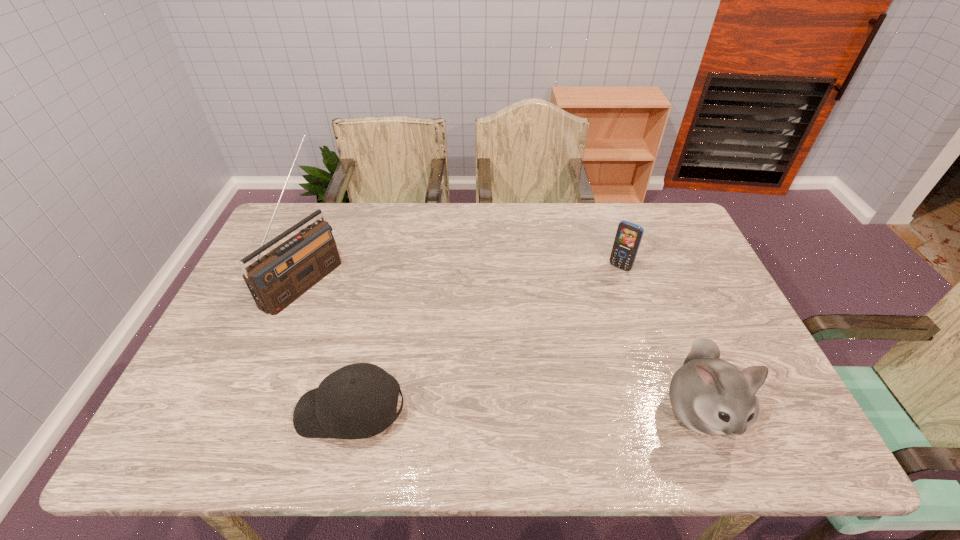
Find the location of a particular element. Image resolution: width=960 pixels, height=540 pixels. vacant region at the far edge of the desktop is located at coordinates (509, 217).

At what (x,y) coordinates should I click in order to perform the action: click on free space at the near edge of the desktop. Please return your answer as a coordinate pair (x, y). The height and width of the screenshot is (540, 960). Looking at the image, I should click on (653, 378).

In the image, there is a desktop. At what (x,y) coordinates should I click in order to perform the action: click on vacant space at the left edge. Please return your answer as a coordinate pair (x, y). The width and height of the screenshot is (960, 540). Looking at the image, I should click on click(248, 308).

The width and height of the screenshot is (960, 540). I want to click on vacant region at the right edge of the desktop, so click(678, 288).

Where is `vacant space at the far left corner`? The width and height of the screenshot is (960, 540). vacant space at the far left corner is located at coordinates (284, 221).

Find the location of a particular element. The image size is (960, 540). free space at the far right corner of the desktop is located at coordinates (647, 212).

Image resolution: width=960 pixels, height=540 pixels. In the image, there is a desktop. Find the location of `vacant space at the near right corner`. vacant space at the near right corner is located at coordinates (771, 409).

Find the location of `unoccupied position between the baseball cap and the cellular telephone`. unoccupied position between the baseball cap and the cellular telephone is located at coordinates (485, 340).

Where is `free space that is in between the baseball cap and the tallest object`? free space that is in between the baseball cap and the tallest object is located at coordinates (327, 346).

What are the coordinates of `empty space that is in between the hamster and the cellular telephone` in the screenshot? It's located at (660, 339).